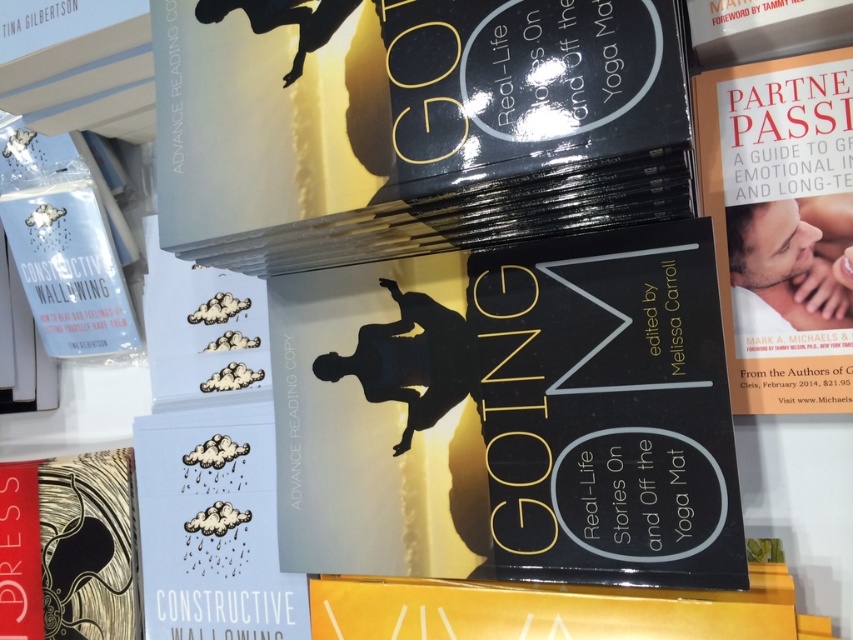
You are standing in front of the bookstore shelf and want to reach a point on the shelf. Which point, point at coordinates [548,371] or point at coordinates [828,348], is easier to reach without moving your hand too far from your body?

Point at coordinates [548,371] is closer to the camera than point at coordinates [828,348], so it is easier to reach without moving your hand too far from your body.